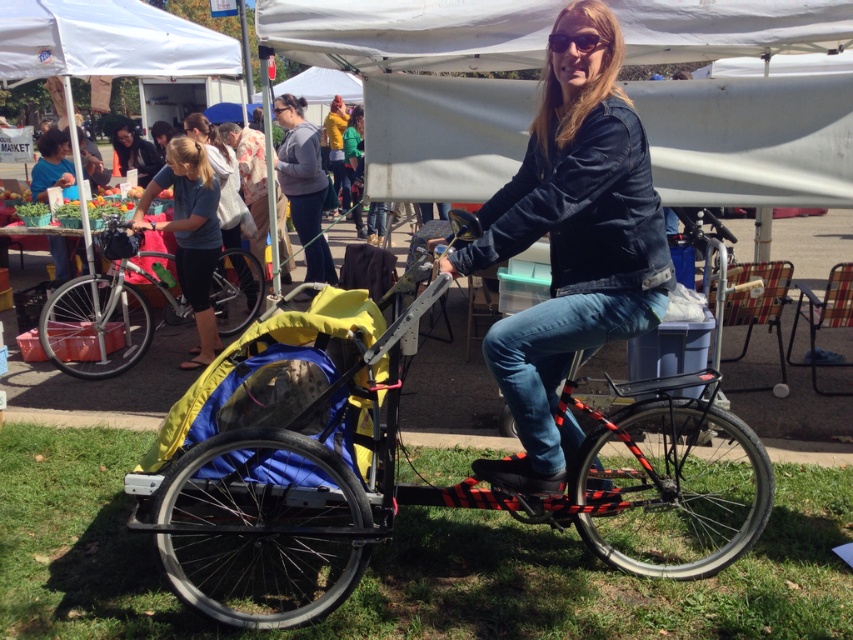
Which is in front, point (285, 529) or point (328, 250)?

Point (285, 529)

Does point (685, 531) lie in front of point (292, 157)?

Yes, it is in front of point (292, 157).

Between point (262, 465) and point (318, 209), which one is positioned in front?

Positioned in front is point (262, 465).

Find the location of `black plastic tricycle at center`. black plastic tricycle at center is located at coordinates (433, 490).

Can you confirm if silver metallic bicycle at center is taller than matte black jacket at upper center?

Yes, silver metallic bicycle at center is taller than matte black jacket at upper center.

Is point (50, 326) closer to camera compared to point (131, 136)?

Yes, point (50, 326) is closer to viewer.

At what (x,y) coordinates should I click in order to perform the action: click on silver metallic bicycle at center. Please return your answer as a coordinate pair (x, y). Looking at the image, I should click on (106, 317).

Who is shorter, denim jacket at center or gray fleece hoodie at center?

denim jacket at center

What do you see at coordinates (572, 241) in the screenshot?
I see `denim jacket at center` at bounding box center [572, 241].

Identify the location of denim jacket at center. (572, 241).